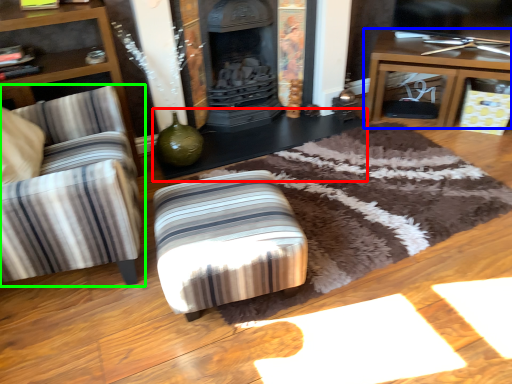
Question: Based on their relative distances, which object is nearer to table (highlighted by a red box)? Choose from table (highlighted by a blue box) and chair (highlighted by a green box).

Choices:
 (A) table
 (B) chair

Answer: (A)